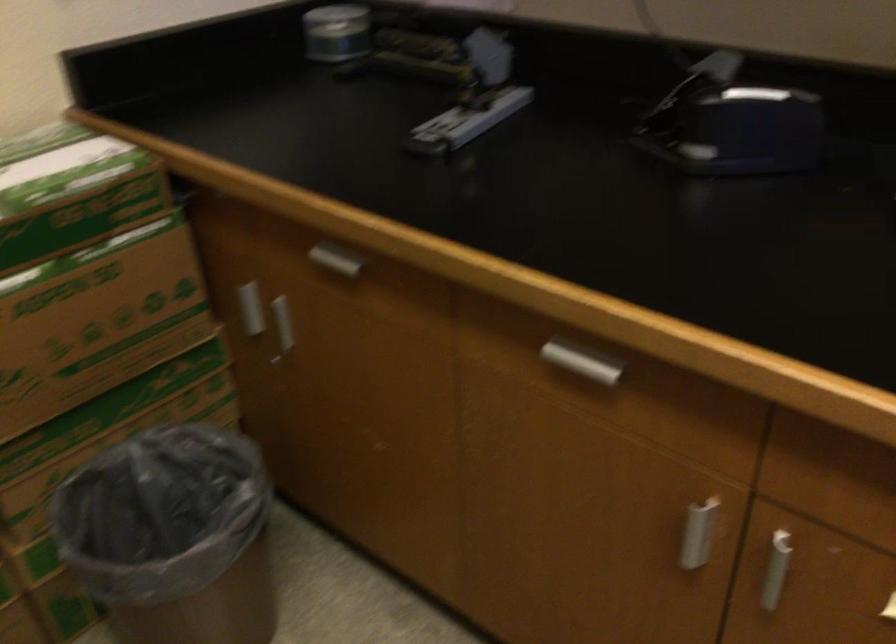
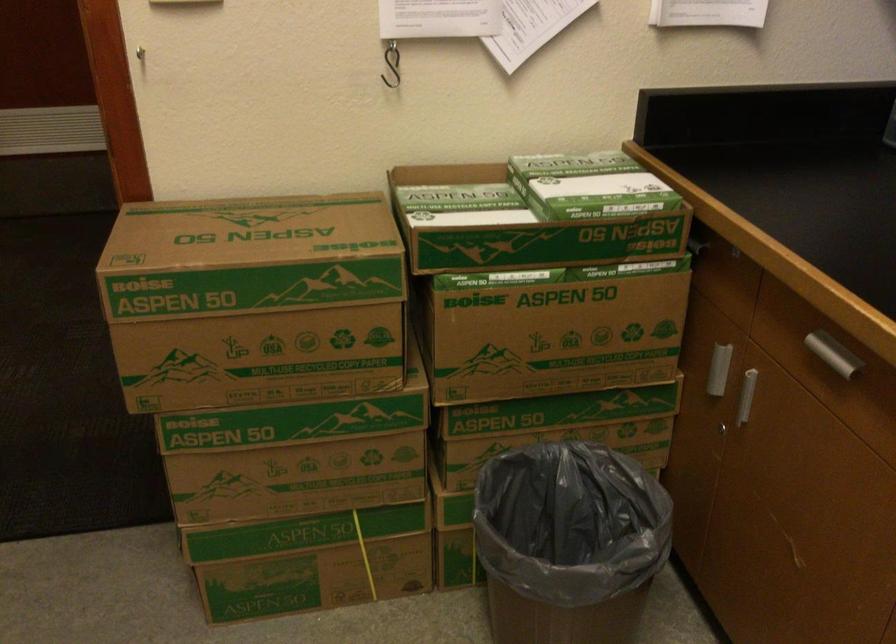
Find the pixel in the second image that matches (x=283, y=359) in the first image.

(727, 433)